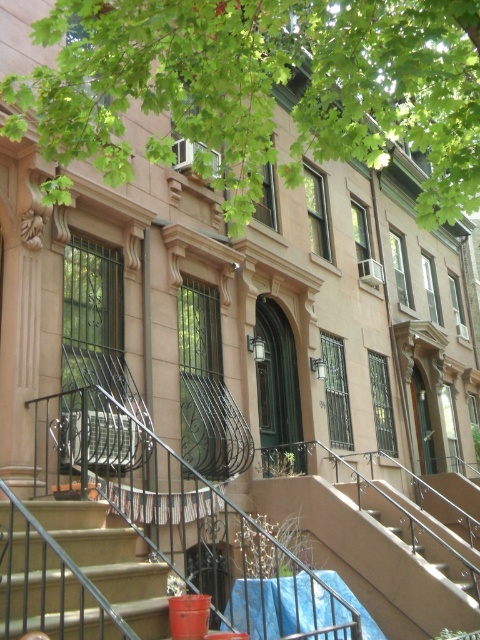
Based on the photo, you are a window cleaner standing on the ground floor of the brownstone building. You need to clean the green leafy tree at upper center and the smooth concrete stairs at center. Which object is taller and requires you to climb higher?

The green leafy tree at upper center is taller than the smooth concrete stairs at center, so you will need to climb higher to reach the green leafy tree at upper center.

You are standing at the entrance of the brownstone building and want to take a photo of the green leafy tree at upper center using a camera that has a maximum focus range of 3 meters. Can you capture the tree clearly without moving closer?

The green leafy tree at upper center and the camera are 3.01 meters apart, which is slightly beyond the camera maximum focus range of 3 meters. Therefore, you cannot capture the tree clearly without moving closer.

You are standing at the entrance of the brownstone building and want to find the green leafy tree at upper center. Which direction should you look relative to the smooth concrete stairs at center?

The green leafy tree at upper center is to the right of the smooth concrete stairs at center, so you should look to the right of the smooth concrete stairs at center to find it.